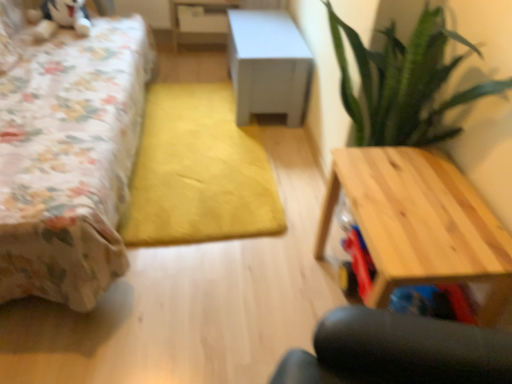
Question: Do you think white glossy table at upper center, acting as the 1th table starting from the back, is within floral fabric bed at left, or outside of it?

Choices:
 (A) inside
 (B) outside

Answer: (B)

Question: From a real-world perspective, relative to floral fabric bed at left, is white glossy table at upper center, the third table in the front-to-back sequence, vertically above or below?

Choices:
 (A) below
 (B) above

Answer: (A)

Question: Considering the real-world distances, which object is closest to the floral fabric bed at left?

Choices:
 (A) light wood table at right, placed as the third table when sorted from back to front
 (B) white glossy table at upper center, the third table in the front-to-back sequence
 (C) white matte cabinet at center, positioned as the second table in front-to-back order

Answer: (C)

Question: Estimate the real-world distances between objects in this image. Which object is closer to the light wood table at right, marked as the first table in a front-to-back arrangement?

Choices:
 (A) white matte cabinet at center, which ranks as the 2th table in bottom-to-top order
 (B) white glossy table at upper center, placed as the third table when sorted from bottom to top
 (C) floral fabric bed at left

Answer: (C)